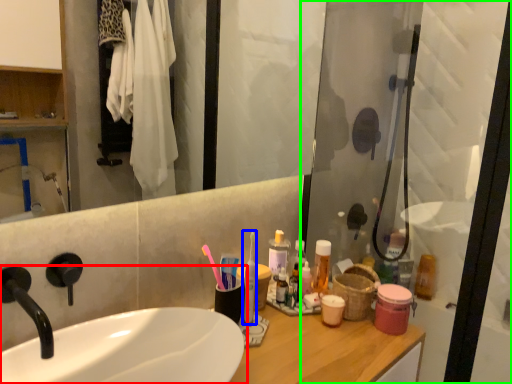
Question: Which object is the closest to the sink (highlighted by a red box)? Choose among these: toothbrush (highlighted by a blue box) or screen door (highlighted by a green box).

Choices:
 (A) toothbrush
 (B) screen door

Answer: (A)